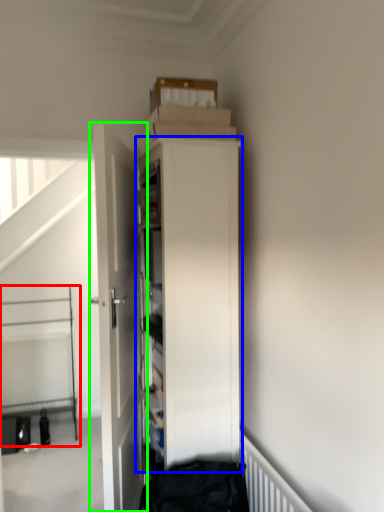
Question: Considering the real-world distances, which object is farthest from bed (highlighted by a red box)? cabinetry (highlighted by a blue box) or door (highlighted by a green box)?

Choices:
 (A) cabinetry
 (B) door

Answer: (A)